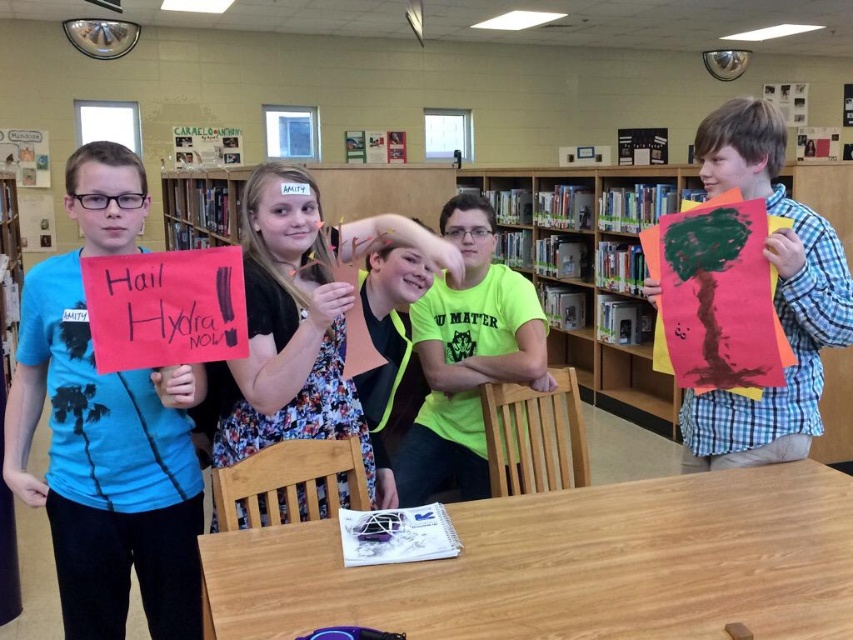
Between floral dress at center and neon green t-shirt at center, which one is positioned higher?

floral dress at center

Is floral dress at center taller than neon green t-shirt at center?

No.

You are a GUI agent. You are given a task and a screenshot of the screen. Output one action in this format:
    pyautogui.click(x=<x>, y=<y>)
    Task: Click on the floral dress at center
    
    Given the screenshot: What is the action you would take?
    pyautogui.click(x=287, y=330)

Who is more forward, (190, 572) or (263, 368)?

Positioned in front is point (263, 368).

Is matte blue t-shirt at left further to the viewer compared to floral dress at center?

No.

This screenshot has height=640, width=853. What do you see at coordinates (106, 429) in the screenshot?
I see `matte blue t-shirt at left` at bounding box center [106, 429].

Locate an element on the screen. The image size is (853, 640). matte blue t-shirt at left is located at coordinates (106, 429).

Which of these two, wooden bookshelf at center or plaid fabric shirt at right, stands shorter?

wooden bookshelf at center is shorter.

Is wooden bookshelf at center behind plaid fabric shirt at right?

Yes, wooden bookshelf at center is further from the viewer.

Find the location of `wooden bookshelf at center`. wooden bookshelf at center is located at coordinates (463, 180).

Find the location of a particular element. The height and width of the screenshot is (640, 853). wooden bookshelf at center is located at coordinates (463, 180).